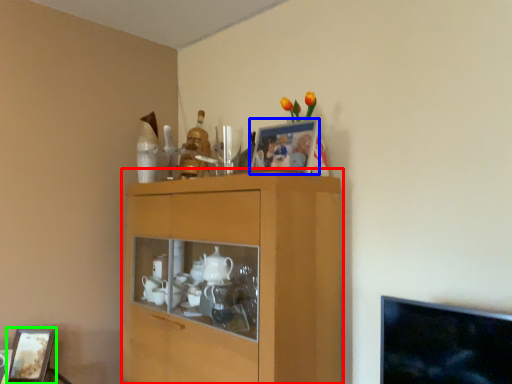
Question: Estimate the real-world distances between objects in this image. Which object is farther from cabinetry (highlighted by a red box), picture frame (highlighted by a blue box) or picture frame (highlighted by a green box)?

Choices:
 (A) picture frame
 (B) picture frame

Answer: (B)